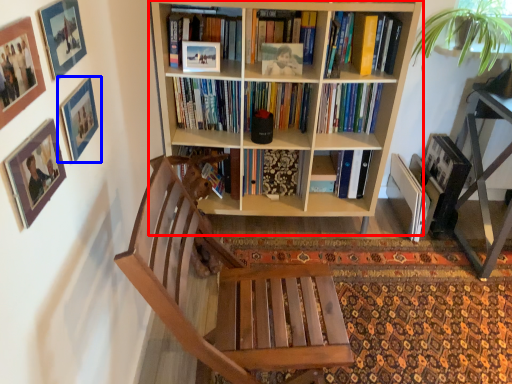
Question: Which of the following is the closest to the observer, bookcase (highlighted by a red box) or picture frame (highlighted by a blue box)?

Choices:
 (A) bookcase
 (B) picture frame

Answer: (B)